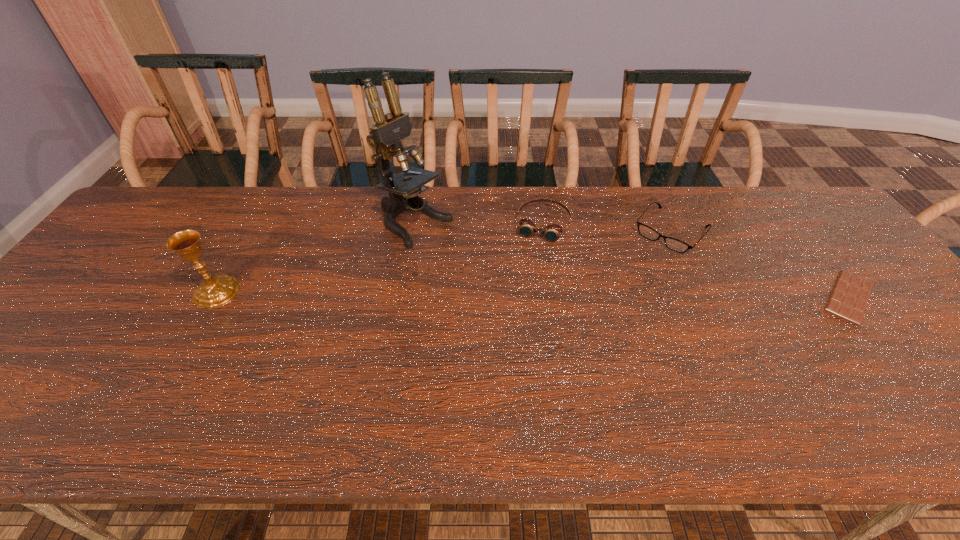
This screenshot has width=960, height=540. I want to click on free space that is in between the goggles and the leftmost object, so click(380, 258).

Identify which object is located as the nearest to the third object from right to left. Please provide its 2D coordinates. Your answer should be formatted as a tuple, i.e. [(x, y)], where the tuple contains the x and y coordinates of a point satisfying the conditions above.

[(673, 244)]

In order to click on object that is the third closest one to the tallest object in this screenshot , I will do `click(673, 244)`.

At what (x,y) coordinates should I click in order to perform the action: click on free location that satisfies the following two spatial constraints: 1. on the back side of the tallest object; 2. on the right side of the third object from right to left. Please return your answer as a coordinate pair (x, y). Looking at the image, I should click on (415, 224).